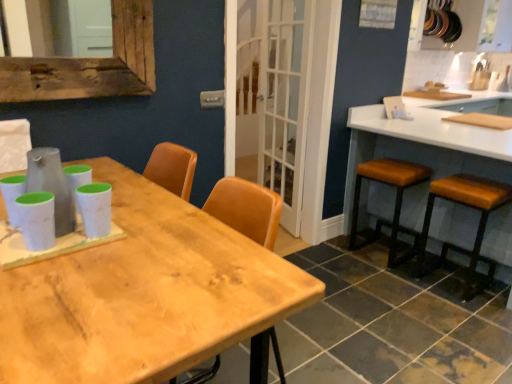
The width and height of the screenshot is (512, 384). In order to click on vacant area that is in front of brown leather stool at right, the second stool viewed from the left in this screenshot , I will do `click(468, 314)`.